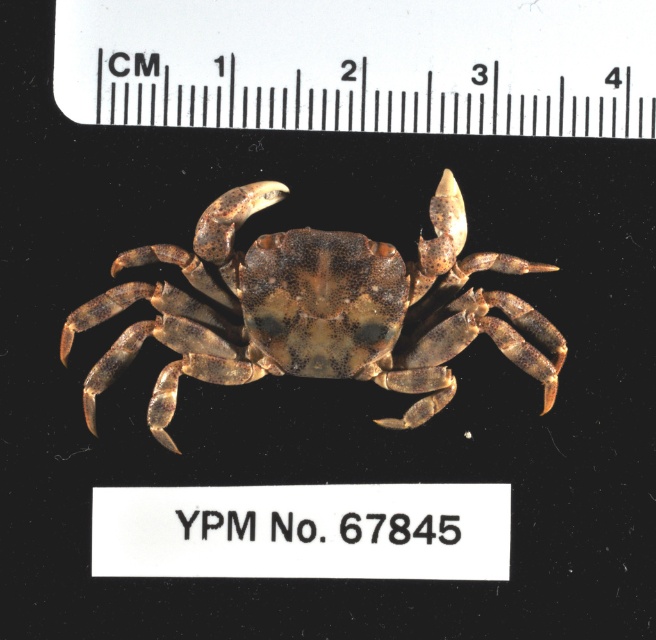
Measure the distance between white plastic ruler at upper center and brown textured crab at center.

white plastic ruler at upper center is 9.54 inches from brown textured crab at center.

Does white plastic ruler at upper center have a larger size compared to brown textured crab at center?

No, white plastic ruler at upper center is not bigger than brown textured crab at center.

Is point (518, 122) positioned after point (291, 260)?

Yes.

The height and width of the screenshot is (640, 656). Identify the location of white plastic ruler at upper center. (359, 65).